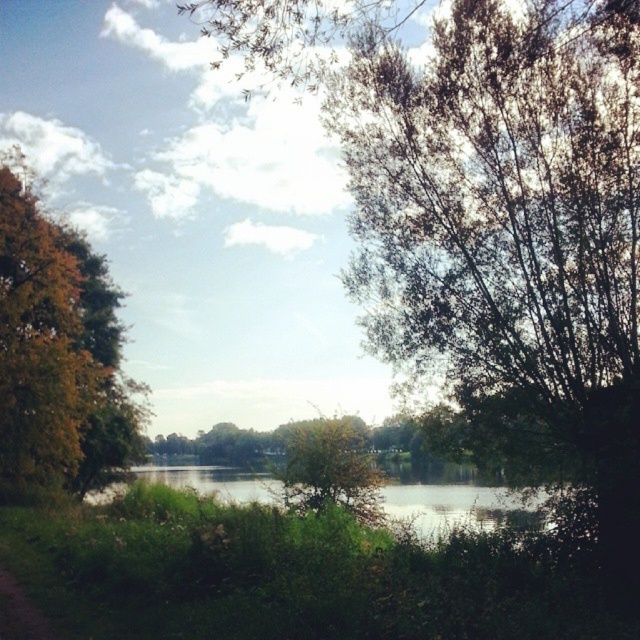
Question: Which point is farther to the camera?

Choices:
 (A) green grassy river at center
 (B) orange leafy tree at left
 (C) green leafy tree at center

Answer: (C)

Question: Which object is the farthest from the green leafy tree at center?

Choices:
 (A) orange leafy tree at left
 (B) green grassy river at center

Answer: (A)

Question: Does orange leafy tree at left come behind green grassy river at center?

Choices:
 (A) yes
 (B) no

Answer: (A)

Question: Is orange leafy tree at left positioned before green grassy river at center?

Choices:
 (A) no
 (B) yes

Answer: (A)

Question: Which is farther from the orange leafy tree at left?

Choices:
 (A) green leafy tree at center
 (B) green grassy river at center

Answer: (A)

Question: Is green grassy river at center bigger than green leafy tree at center?

Choices:
 (A) no
 (B) yes

Answer: (B)